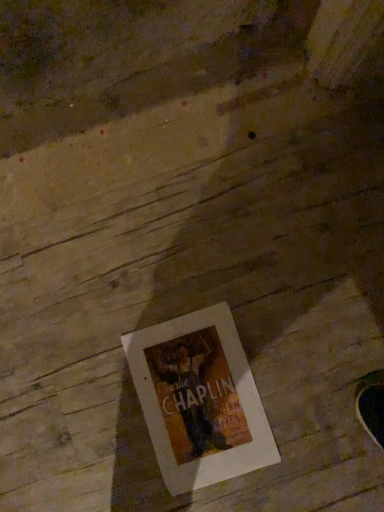
In order to click on blank space situated above matte paper book at center (from a real-world perspective) in this screenshot , I will do `click(199, 404)`.